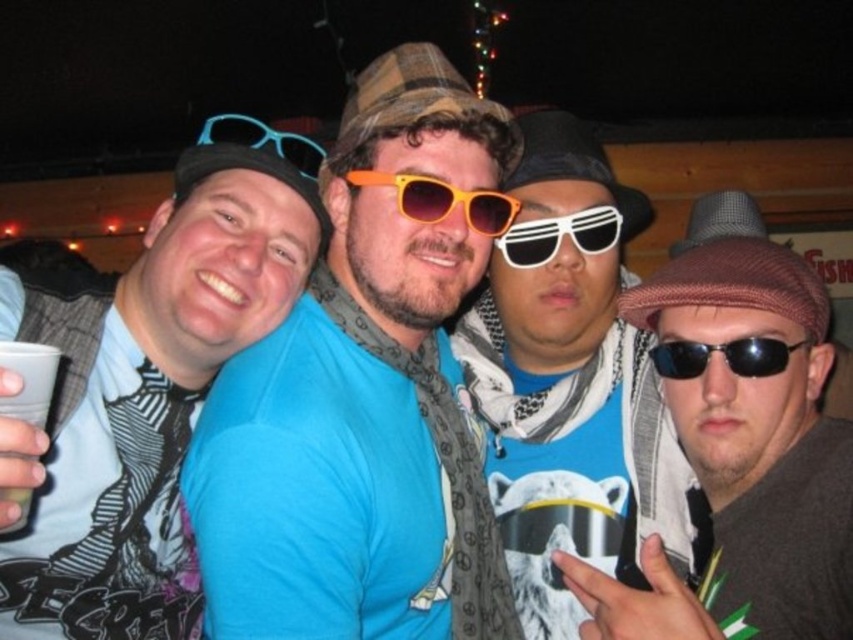
Does point (45, 541) come farther from viewer compared to point (467, 192)?

No, (45, 541) is closer to viewer.

Between point (173, 184) and point (401, 182), which one is positioned in front?

Point (401, 182) is more forward.

The image size is (853, 640). I want to click on matte black cap at left, so click(x=146, y=396).

Is brown woolen cap at right above black reflective sunglasses at right?

No, brown woolen cap at right is not above black reflective sunglasses at right.

Does point (837, 628) lie in front of point (732, 365)?

Yes, it is in front of point (732, 365).

Locate an element on the screen. brown woolen cap at right is located at coordinates (744, 451).

Who is more forward, (792, 532) or (541, 225)?

Point (792, 532) is in front.

I want to click on brown woolen cap at right, so click(744, 451).